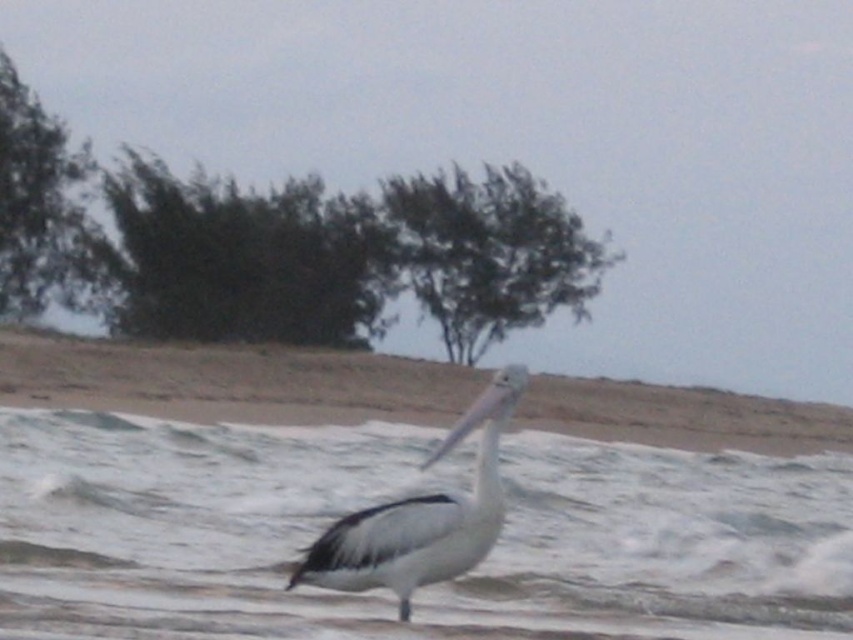
You are a photographer trying to capture the pelican in the image. You want to position yourself so that the white smooth water at center is between the dark green leafy tree at upper center and the pelican. Is this possible based on their current positions?

The white smooth water at center is to the right of dark green leafy tree at upper center. Since the pelican is at the bottom right, positioning yourself so that the water is between the tree and the pelican would require the water to be in a line between them. However, since the water is already to the right of the tree and the pelican is also at the bottom right, the water cannot be between them in this arrangement. Therefore, it is not possible to position yourself in such a way.

You are a photographer trying to capture the white smooth water at center and the white matte pelican at center in a single shot. Which object will occupy more of the frame in your photo?

The white smooth water at center is bigger than the white matte pelican at center, so it will occupy more of the frame in the photo.

You are standing on the beach looking at the dark green leafy tree at upper center and the green leafy tree at center. Which tree is nearer to you?

The dark green leafy tree at upper center is closer to the viewer than the green leafy tree at center.